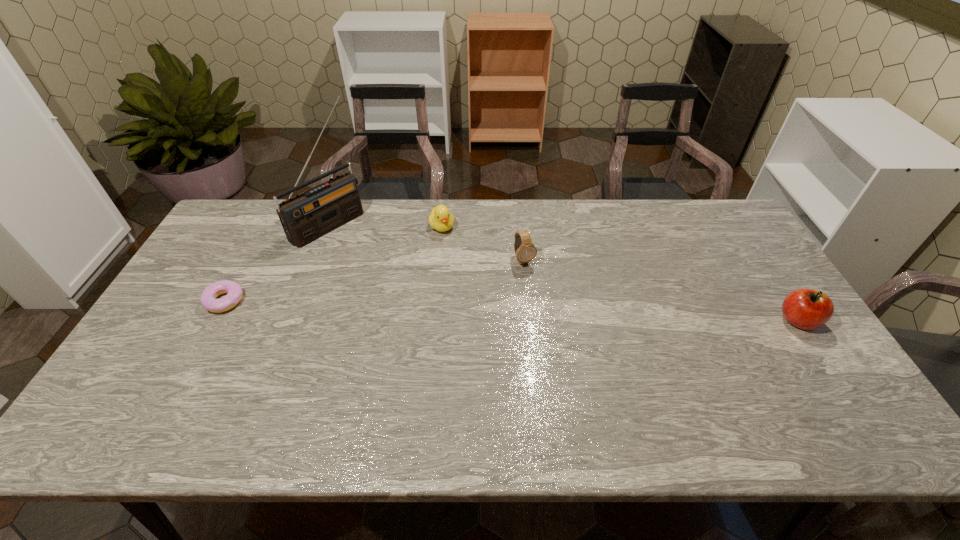
This screenshot has height=540, width=960. Identify the location of doughnut. (208, 299).

Locate an element on the screen. the shortest object is located at coordinates (208, 299).

Find the location of a particular element. This screenshot has width=960, height=540. apple is located at coordinates (807, 309).

Where is `duckling`? duckling is located at coordinates (440, 219).

The width and height of the screenshot is (960, 540). I want to click on the fourth tallest object, so click(440, 219).

This screenshot has width=960, height=540. I want to click on the fourth object from right to left, so click(x=306, y=217).

You are a GUI agent. You are given a task and a screenshot of the screen. Output one action in this format:
    pyautogui.click(x=<x>, y=<y>)
    Task: Click on the tallest object
    The image size is (960, 540).
    Given the screenshot: What is the action you would take?
    pyautogui.click(x=306, y=217)

Find the location of a particular element. The image size is (960, 540). the fourth object from left to right is located at coordinates (525, 251).

Locate an element on the screen. The width and height of the screenshot is (960, 540). watch is located at coordinates (x=525, y=251).

The width and height of the screenshot is (960, 540). Find the location of `free space located 0.180m on the front of the doughnut`. free space located 0.180m on the front of the doughnut is located at coordinates (186, 371).